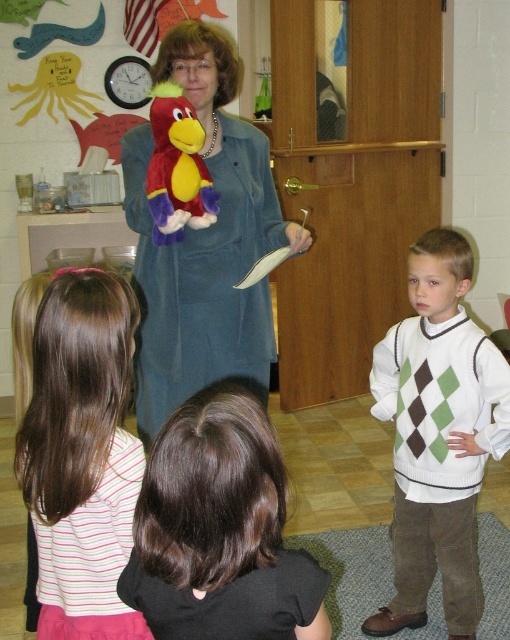
You are a student sitting on the floor in the classroom. You want to reach both the point at coordinates point (240, 150) and point (468, 266). Which point should you reach for first?

You should reach for point (240, 150) first because it is closer to you than point (468, 266), which is further away.

Where is the velvety blue coat at center located in the image?

The velvety blue coat at center is located at the coordinates point (x=204, y=243).